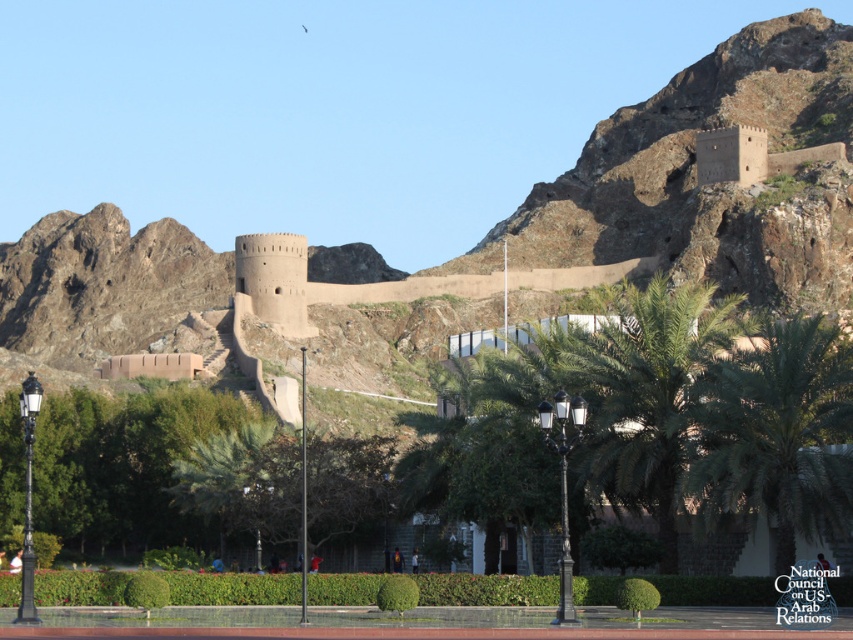
Is green leafy palm tree at center in front of green leafy palm at center?

Yes, it is.

Who is more forward, (824, 410) or (656, 324)?

Point (824, 410)

At what (x,y) coordinates should I click in order to perform the action: click on green leafy palm tree at center. Please return your answer as a coordinate pair (x, y). This screenshot has height=640, width=853. Looking at the image, I should click on (776, 435).